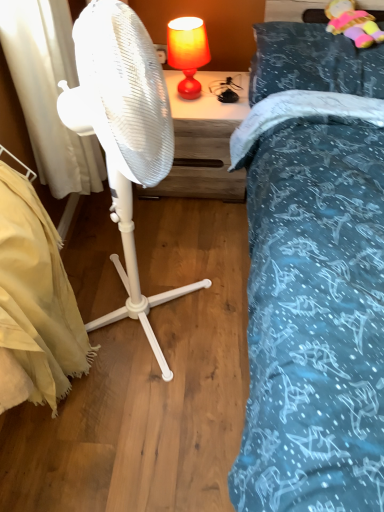
I want to click on vacant space in between white plastic fan at center and beige fabric mattress at lower left, so click(117, 361).